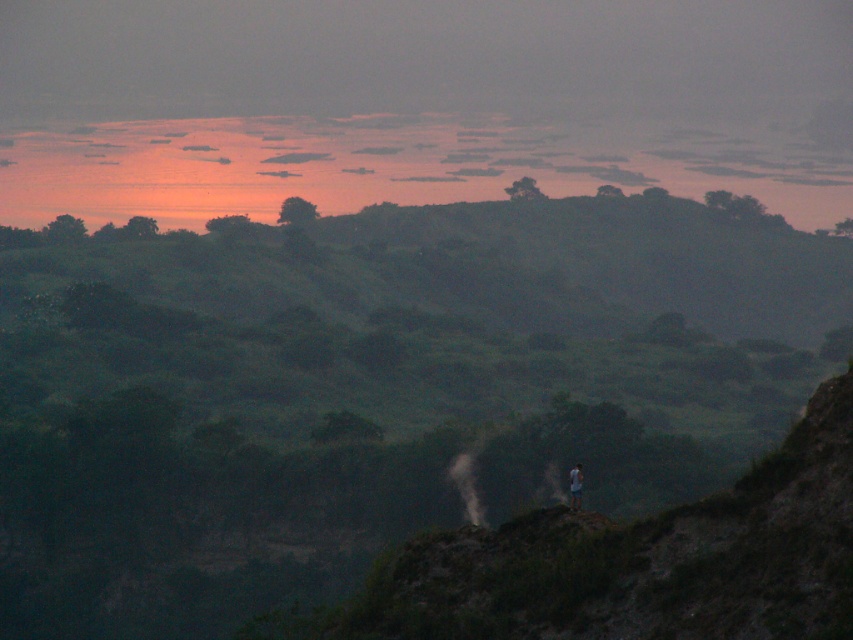
Looking at this image, can you confirm if green grassy hill at center is positioned to the left of blue denim shorts at center?

Correct, you'll find green grassy hill at center to the left of blue denim shorts at center.

Between green grassy hill at center and blue denim shorts at center, which one appears on the left side from the viewer's perspective?

green grassy hill at center

This screenshot has height=640, width=853. Identify the location of green grassy hill at center. (374, 388).